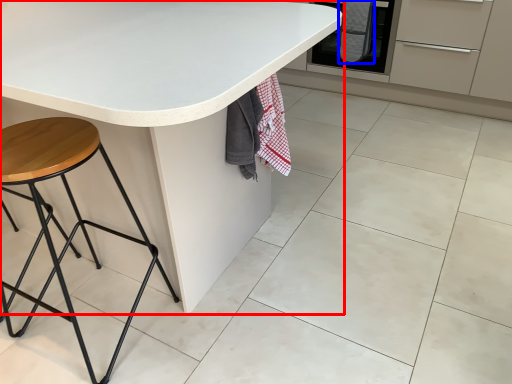
Question: Among these objects, which one is farthest to the camera, table (highlighted by a red box) or blanket (highlighted by a blue box)?

Choices:
 (A) table
 (B) blanket

Answer: (B)